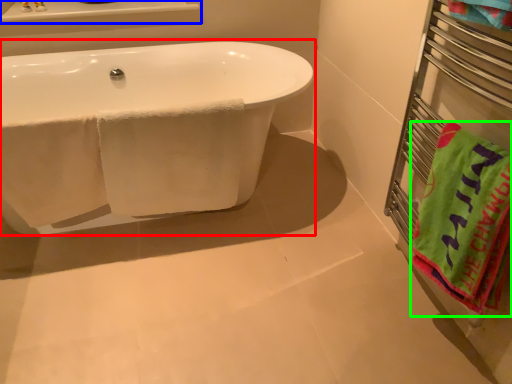
Question: Based on their relative distances, which object is farther from bathtub (highlighted by a red box)? Choose from window sill (highlighted by a blue box) and beach towel (highlighted by a green box).

Choices:
 (A) window sill
 (B) beach towel

Answer: (B)